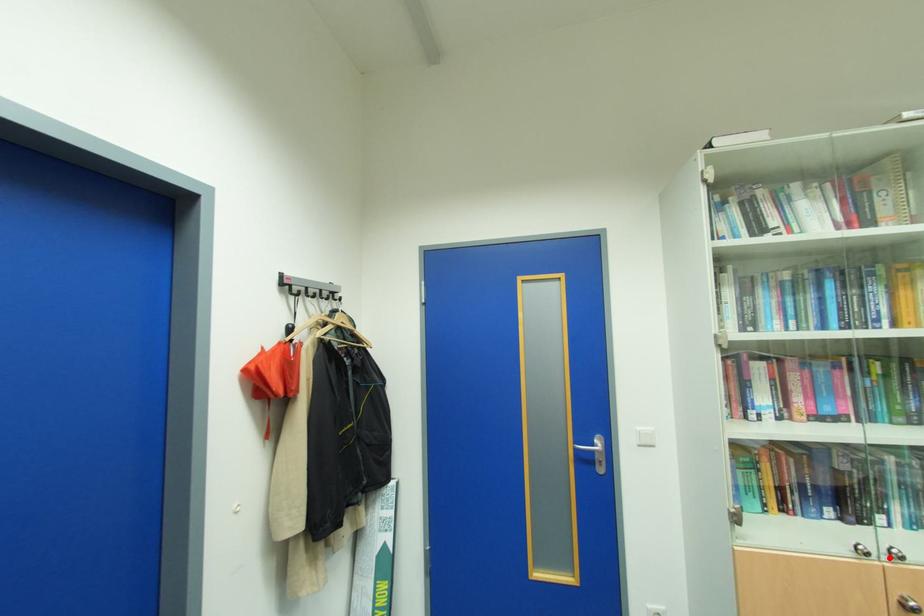
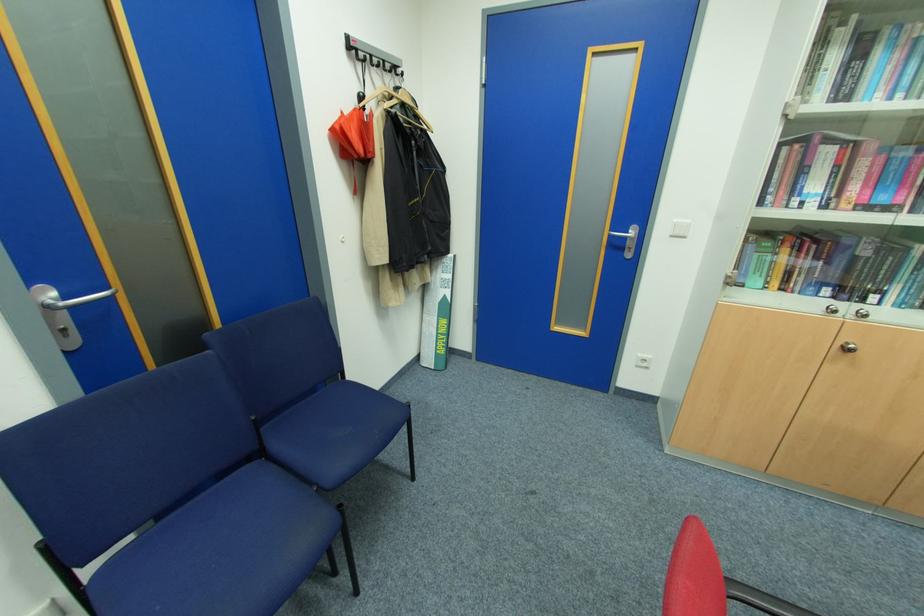
Question: A red point is marked in image1. In image2, is the corresponding 3D point closer to the camera or farther? Reply with the corresponding letter.

Choices:
 (A) The corresponding 3D point is closer.
 (B) The corresponding 3D point is farther.

Answer: (B)